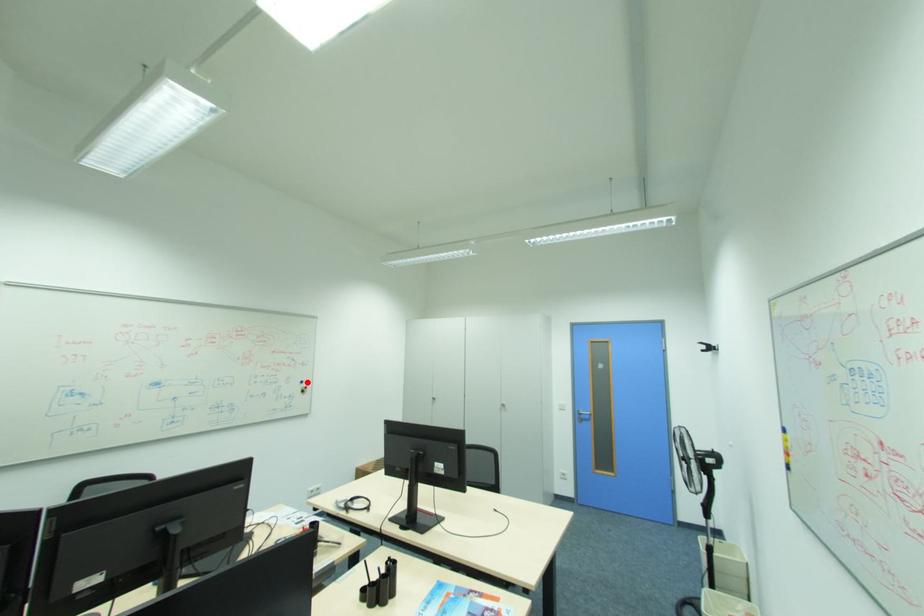
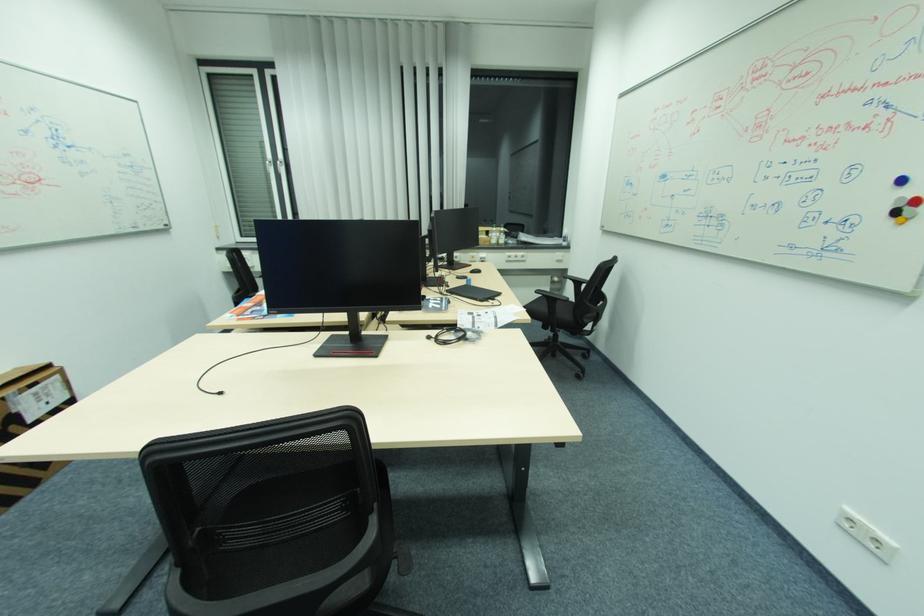
Find the pixel in the second image that matches the highlighted location in the first image.

(908, 180)